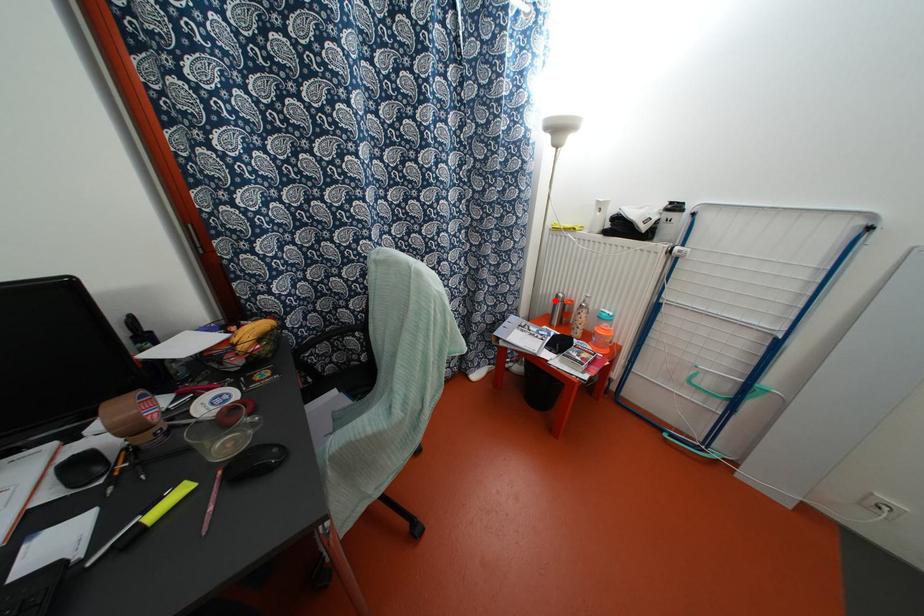
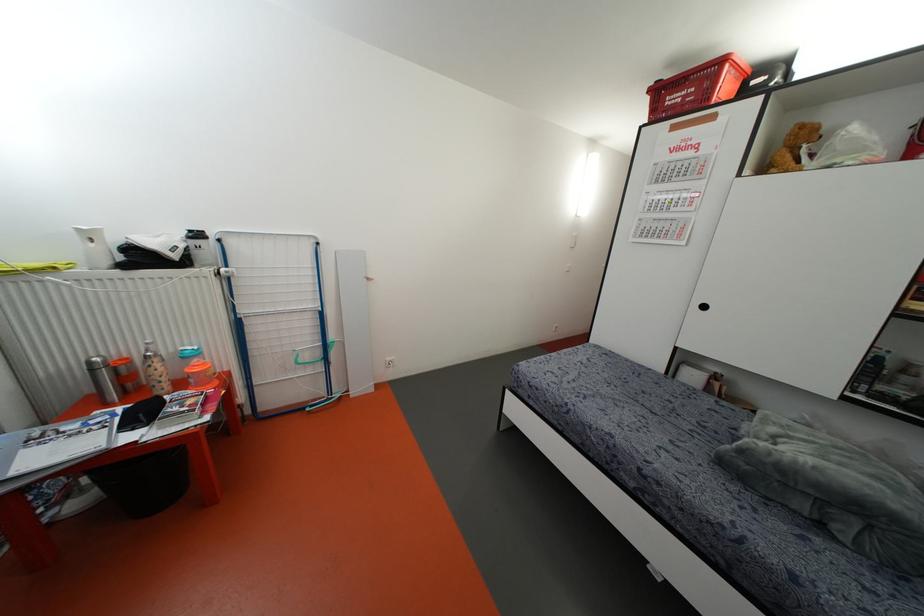
Where in the second image is the point corresponding to the highlighted location from the first image?

(91, 370)